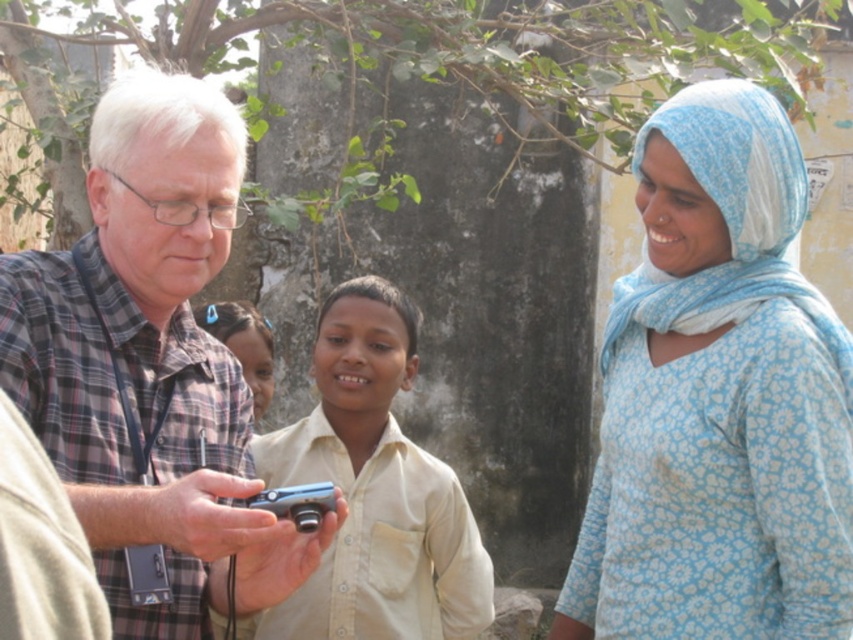
Can you confirm if plaid shirt at left is taller than beige cotton shirt at center?

Yes.

Is plaid shirt at left in front of beige cotton shirt at center?

Yes, plaid shirt at left is closer to the viewer.

Is point (71, 474) closer to viewer compared to point (291, 483)?

Yes, point (71, 474) is in front of point (291, 483).

Locate an element on the screen. This screenshot has height=640, width=853. plaid shirt at left is located at coordinates (151, 369).

Measure the distance between point (622, 401) and camera.

Point (622, 401) is 37.61 meters away from camera.

Which of these two, light blue floral fabric headscarf at right or plaid shirt at left, stands taller?

plaid shirt at left is taller.

What are the coordinates of `light blue floral fabric headscarf at right` in the screenshot? It's located at (718, 400).

Between light blue floral fabric headscarf at right and beige cotton shirt at center, which one appears on the left side from the viewer's perspective?

Positioned to the left is beige cotton shirt at center.

Is light blue floral fabric headscarf at right closer to camera compared to beige cotton shirt at center?

Yes, light blue floral fabric headscarf at right is in front of beige cotton shirt at center.

Does point (766, 211) lie behind point (288, 616)?

No, (766, 211) is closer to viewer.

At what (x,y) coordinates should I click in order to perform the action: click on light blue floral fabric headscarf at right. Please return your answer as a coordinate pair (x, y). The height and width of the screenshot is (640, 853). Looking at the image, I should click on (718, 400).